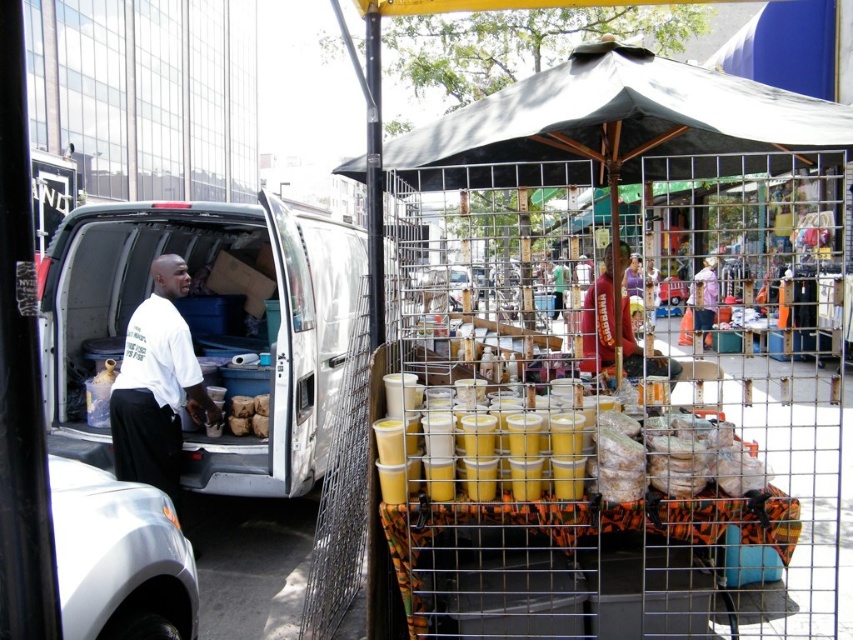
You are a delivery person who needs to place a rectangular box that is 10 inches wide between the yellow matte cups at center and the white matte shirt at left. Based on the scene, can you determine if the space between them is wide enough to fit the box?

The yellow matte cups at center might be wider than white matte shirt at left, so the space between them may not be sufficient to fit a 10 inch wide box. Check the actual width before placing the box.

You are standing in front of the metal cart with a grid structure and colorful fabric. There are two points marked on the cart. One is at coordinate point (x=582, y=413) and the other is at point (x=125, y=456). Which of these two points is closer to your viewpoint?

Point (x=582, y=413) is closer to the camera than point (x=125, y=456).

You are a pedestrian standing in front of the white matte van at left and the white matte shirt at left. Which object is closer to you?

The white matte shirt at left is closer to you because it is positioned under the white matte van at left, meaning the van is behind the shirt from your perspective.